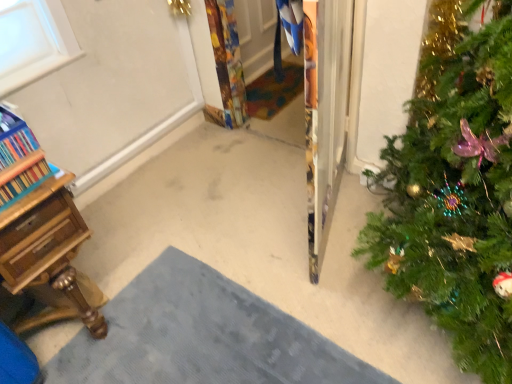
Measure the distance between gray textured doormat at lower center, arranged as the second doormat when viewed from the top, and camera.

The distance of gray textured doormat at lower center, arranged as the second doormat when viewed from the top, from camera is 1.43 meters.

Find the location of a particular element. multicolored woven mat at center, which is the first doormat from back to front is located at coordinates (274, 90).

This screenshot has width=512, height=384. I want to click on wooden bookcase at left, so click(x=19, y=160).

This screenshot has height=384, width=512. Describe the element at coordinates (454, 189) in the screenshot. I see `green matte christmas tree at right` at that location.

Locate an element on the screen. This screenshot has width=512, height=384. gray textured doormat at lower center, the first doormat when ordered from bottom to top is located at coordinates click(202, 336).

Who is smaller, green matte christmas tree at right or wooden desk at lower left?

wooden desk at lower left.

From the image's perspective, between green matte christmas tree at right and wooden desk at lower left, who is located below?

wooden desk at lower left appears lower in the image.

Considering the sizes of objects green matte christmas tree at right and wooden desk at lower left in the image provided, who is taller, green matte christmas tree at right or wooden desk at lower left?

green matte christmas tree at right is taller.

Is green matte christmas tree at right surrounding wooden desk at lower left?

No, wooden desk at lower left is not inside green matte christmas tree at right.

Locate an element on the screen. The height and width of the screenshot is (384, 512). desk that appears below the green matte christmas tree at right (from a real-world perspective) is located at coordinates click(x=48, y=255).

From a real-world perspective, is wooden desk at lower left located beneath green matte christmas tree at right?

Yes, from a real-world perspective, wooden desk at lower left is under green matte christmas tree at right.

Is wooden desk at lower left inside or outside of green matte christmas tree at right?

wooden desk at lower left is not enclosed by green matte christmas tree at right.

From the image's perspective, which is below, wooden desk at lower left or green matte christmas tree at right?

wooden desk at lower left appears lower in the image.

Identify the location of doormat that is the 2nd object located behind the green matte christmas tree at right. This screenshot has height=384, width=512. (274, 90).

Choose the correct answer: Is green matte christmas tree at right inside multicolored woven mat at center, the 2th doormat from the front, or outside it?

green matte christmas tree at right is not enclosed by multicolored woven mat at center, the 2th doormat from the front.

From the picture: Would you consider green matte christmas tree at right to be distant from multicolored woven mat at center, which is counted as the 2th doormat, starting from the bottom?

Indeed, green matte christmas tree at right is not near multicolored woven mat at center, which is counted as the 2th doormat, starting from the bottom.

Considering the relative sizes of green matte christmas tree at right and multicolored woven mat at center, which is the 1th doormat in top-to-bottom order, in the image provided, is green matte christmas tree at right bigger than multicolored woven mat at center, which is the 1th doormat in top-to-bottom order,?

Yes, green matte christmas tree at right is bigger than multicolored woven mat at center, which is the 1th doormat in top-to-bottom order.

Which is correct: green matte christmas tree at right is inside gray textured doormat at lower center, arranged as the second doormat when viewed from the top, or outside of it?

green matte christmas tree at right lies outside gray textured doormat at lower center, arranged as the second doormat when viewed from the top.

Is green matte christmas tree at right shorter than gray textured doormat at lower center, the first doormat when ordered from bottom to top?

In fact, green matte christmas tree at right may be taller than gray textured doormat at lower center, the first doormat when ordered from bottom to top.

Is green matte christmas tree at right facing towards gray textured doormat at lower center, the first doormat when ordered from bottom to top?

No, green matte christmas tree at right is not facing towards gray textured doormat at lower center, the first doormat when ordered from bottom to top.

From a real-world perspective, between green matte christmas tree at right and gray textured doormat at lower center, the 1th doormat when ordered from front to back, who is vertically higher?

green matte christmas tree at right, from a real-world perspective.

Can you confirm if wooden bookcase at left is smaller than green matte christmas tree at right?

Yes, wooden bookcase at left is smaller than green matte christmas tree at right.

Is point (13, 166) closer or farther from the camera than point (485, 228)?

Point (13, 166) is positioned closer to the camera compared to point (485, 228).

Is wooden bookcase at left in contact with green matte christmas tree at right?

No, wooden bookcase at left is not making contact with green matte christmas tree at right.

Choose the correct answer: Is wooden bookcase at left inside green matte christmas tree at right or outside it?

wooden bookcase at left is spatially situated outside green matte christmas tree at right.

Is gray textured doormat at lower center, the first doormat when ordered from bottom to top, shorter than green matte christmas tree at right?

Correct, gray textured doormat at lower center, the first doormat when ordered from bottom to top, is not as tall as green matte christmas tree at right.

From the image's perspective, which one is positioned higher, gray textured doormat at lower center, which ranks as the second doormat in back-to-front order, or green matte christmas tree at right?

green matte christmas tree at right is shown above in the image.

Is point (312, 368) in front of point (494, 284)?

No.

Which object is positioned more to the left, wooden desk at lower left or gray textured doormat at lower center, the first doormat when ordered from bottom to top?

From the viewer's perspective, wooden desk at lower left appears more on the left side.

From the image's perspective, is wooden desk at lower left located above gray textured doormat at lower center, which ranks as the second doormat in back-to-front order?

Yes, from the image's perspective, wooden desk at lower left is above gray textured doormat at lower center, which ranks as the second doormat in back-to-front order.

Considering their positions, is wooden desk at lower left located in front of or behind gray textured doormat at lower center, the 1th doormat when ordered from front to back?

Clearly, wooden desk at lower left is behind gray textured doormat at lower center, the 1th doormat when ordered from front to back.

The image size is (512, 384). Find the location of `desk behind the green matte christmas tree at right`. desk behind the green matte christmas tree at right is located at coordinates (48, 255).

I want to click on christmas tree above the wooden desk at lower left (from a real-world perspective), so click(x=454, y=189).

Considering their positions, is wooden bookcase at left positioned further to wooden desk at lower left than multicolored woven mat at center, which is counted as the 2th doormat, starting from the bottom?

The object further to wooden desk at lower left is multicolored woven mat at center, which is counted as the 2th doormat, starting from the bottom.

When comparing their distances from green matte christmas tree at right, does wooden bookcase at left or gray textured doormat at lower center, arranged as the second doormat when viewed from the top, seem further?

Among the two, wooden bookcase at left is located further to green matte christmas tree at right.

Estimate the real-world distances between objects in this image. Which object is closer to multicolored woven mat at center, which is the 1th doormat in top-to-bottom order, green matte christmas tree at right or wooden desk at lower left?

The object closer to multicolored woven mat at center, which is the 1th doormat in top-to-bottom order, is green matte christmas tree at right.

From the image, which object appears to be nearer to green matte christmas tree at right, gray textured doormat at lower center, arranged as the second doormat when viewed from the top, or wooden bookcase at left?

gray textured doormat at lower center, arranged as the second doormat when viewed from the top.

Considering their positions, is wooden desk at lower left positioned closer to green matte christmas tree at right than gray textured doormat at lower center, which ranks as the second doormat in back-to-front order?

The object closer to green matte christmas tree at right is gray textured doormat at lower center, which ranks as the second doormat in back-to-front order.

Looking at the image, which one is located closer to gray textured doormat at lower center, the 1th doormat when ordered from front to back, wooden desk at lower left or green matte christmas tree at right?

The object closer to gray textured doormat at lower center, the 1th doormat when ordered from front to back, is wooden desk at lower left.

Looking at the image, which one is located further to multicolored woven mat at center, which is the first doormat from back to front, gray textured doormat at lower center, the first doormat when ordered from bottom to top, or wooden desk at lower left?

wooden desk at lower left is further to multicolored woven mat at center, which is the first doormat from back to front.

Considering their positions, is green matte christmas tree at right positioned closer to gray textured doormat at lower center, which ranks as the second doormat in back-to-front order, than wooden bookcase at left?

The object closer to gray textured doormat at lower center, which ranks as the second doormat in back-to-front order, is green matte christmas tree at right.

Locate an element on the screen. The width and height of the screenshot is (512, 384). bookcase between green matte christmas tree at right and multicolored woven mat at center, the 2th doormat from the front, in the front-back direction is located at coordinates (19, 160).

At what (x,y) coordinates should I click in order to perform the action: click on desk located between gray textured doormat at lower center, the 1th doormat when ordered from front to back, and multicolored woven mat at center, which is the first doormat from back to front, in the depth direction. Please return your answer as a coordinate pair (x, y). Looking at the image, I should click on (48, 255).

Identify the location of bookcase between gray textured doormat at lower center, the first doormat when ordered from bottom to top, and multicolored woven mat at center, which is the first doormat from back to front, in the front-back direction. This screenshot has width=512, height=384. (19, 160).

Image resolution: width=512 pixels, height=384 pixels. In order to click on desk between wooden bookcase at left and gray textured doormat at lower center, arranged as the second doormat when viewed from the top, in the horizontal direction in this screenshot , I will do `click(48, 255)`.